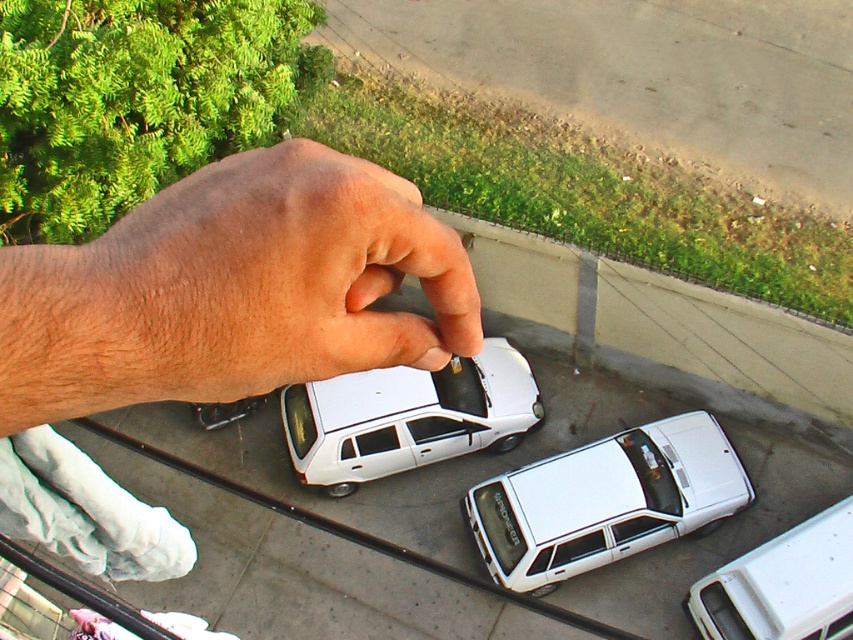
Can you confirm if white matte car at center is wider than white matte car at lower right?

Indeed, white matte car at center has a greater width compared to white matte car at lower right.

Who is lower down, white matte car at center or white matte car at lower right?

white matte car at lower right is lower down.

Is point (308, 384) closer to camera compared to point (723, 618)?

That is False.

Image resolution: width=853 pixels, height=640 pixels. What are the coordinates of `white matte car at center` in the screenshot? It's located at (408, 417).

Is dry skin at center taller than white matte car at lower right?

No, dry skin at center is not taller than white matte car at lower right.

Which is above, dry skin at center or white matte car at lower right?

dry skin at center

Which is behind, point (61, 378) or point (849, 513)?

Positioned behind is point (849, 513).

You are a GUI agent. You are given a task and a screenshot of the screen. Output one action in this format:
    pyautogui.click(x=<x>, y=<y>)
    Task: Click on the dry skin at center
    
    Given the screenshot: What is the action you would take?
    pyautogui.click(x=270, y=280)

Does white matte station wagon at center have a larger size compared to white matte car at center?

Incorrect, white matte station wagon at center is not larger than white matte car at center.

The width and height of the screenshot is (853, 640). Identify the location of white matte station wagon at center. (605, 500).

This screenshot has height=640, width=853. Identify the location of white matte station wagon at center. (605, 500).